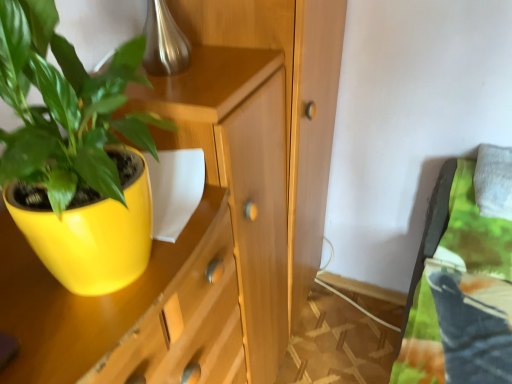
Question: Looking at the image, does matte yellow pot at left seem bigger or smaller compared to matte wood cabinet at center?

Choices:
 (A) small
 (B) big

Answer: (A)

Question: Considering the positions of matte yellow pot at left and matte wood cabinet at center in the image, is matte yellow pot at left wider or thinner than matte wood cabinet at center?

Choices:
 (A) wide
 (B) thin

Answer: (B)

Question: Which of these objects is positioned closest to the white fabric pillow at upper right?

Choices:
 (A) matte wood cabinet at center
 (B) wooden dresser at center
 (C) matte yellow pot at left

Answer: (B)

Question: Which object is the farthest from the wooden dresser at center?

Choices:
 (A) white fabric pillow at upper right
 (B) matte yellow pot at left
 (C) matte wood cabinet at center

Answer: (B)